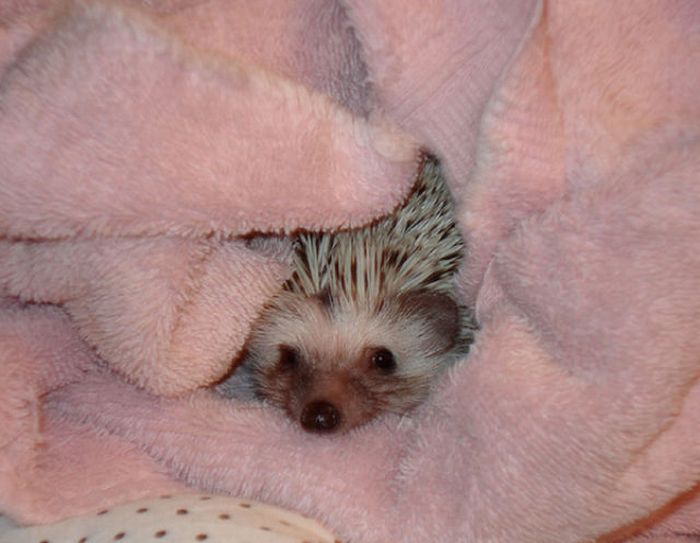
The height and width of the screenshot is (543, 700). What are the coordinates of `blanket hem` in the screenshot? It's located at (523, 37).